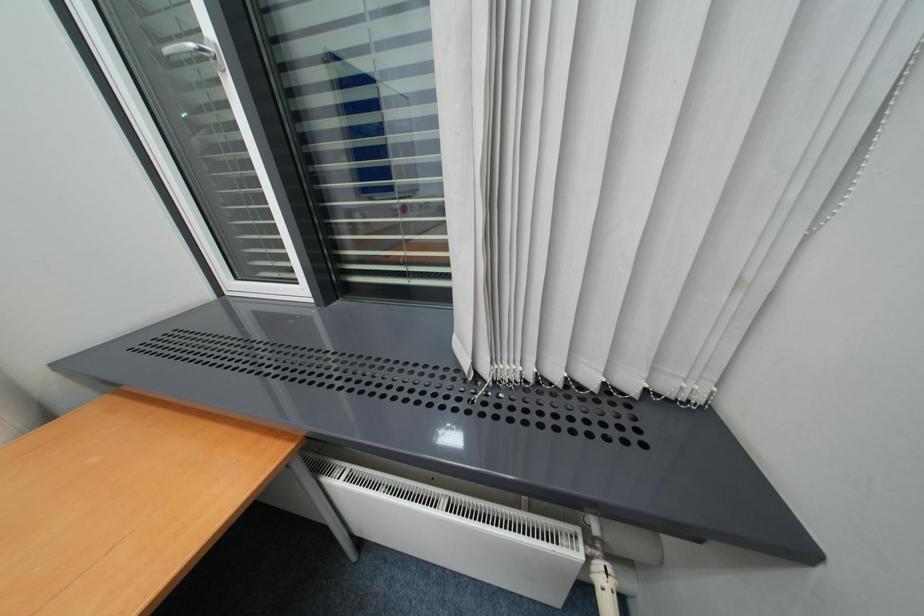
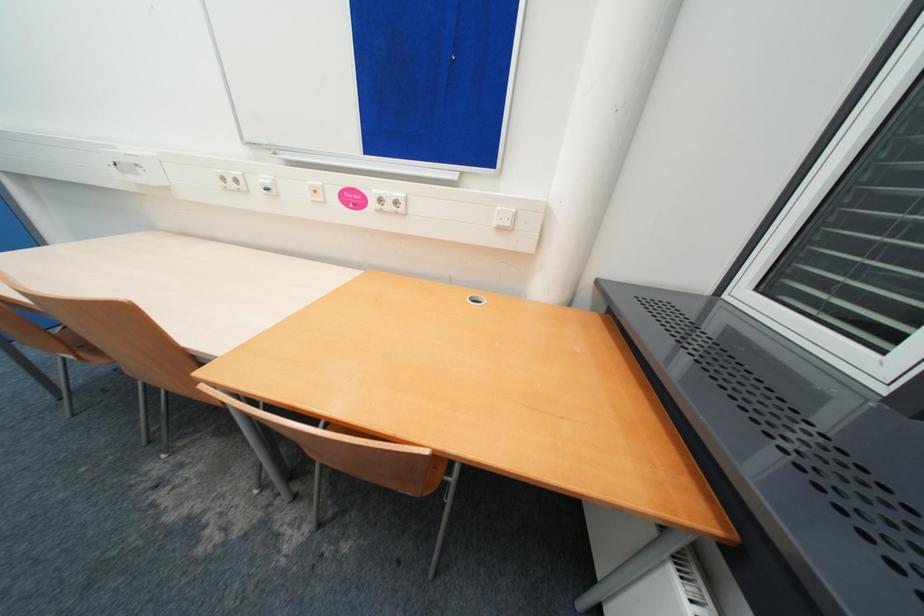
The images are taken continuously from a first-person perspective. In which direction is your viewpoint rotating?

The camera's rotation is toward left-down.